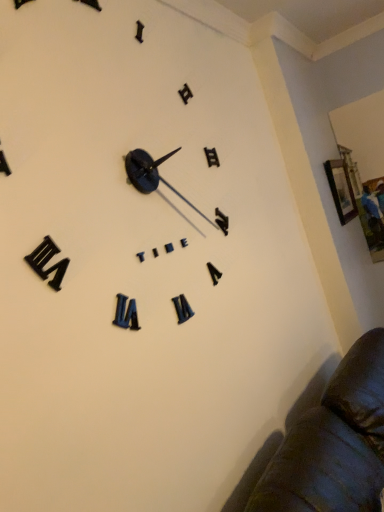
Question: Is wooden picture frame at upper right bigger or smaller than black matte clock at upper center?

Choices:
 (A) big
 (B) small

Answer: (B)

Question: Considering the positions of point (337, 195) and point (119, 183), is point (337, 195) closer or farther from the camera than point (119, 183)?

Choices:
 (A) closer
 (B) farther

Answer: (B)

Question: Do you think wooden picture frame at upper right is within black matte clock at upper center, or outside of it?

Choices:
 (A) outside
 (B) inside

Answer: (A)

Question: Does point (208, 395) appear closer or farther from the camera than point (352, 200)?

Choices:
 (A) farther
 (B) closer

Answer: (B)

Question: In terms of height, does black matte clock at upper center look taller or shorter compared to wooden picture frame at upper right?

Choices:
 (A) short
 (B) tall

Answer: (B)

Question: In terms of width, does black matte clock at upper center look wider or thinner when compared to wooden picture frame at upper right?

Choices:
 (A) wide
 (B) thin

Answer: (A)

Question: From a real-world perspective, is black matte clock at upper center physically located above or below wooden picture frame at upper right?

Choices:
 (A) below
 (B) above

Answer: (B)